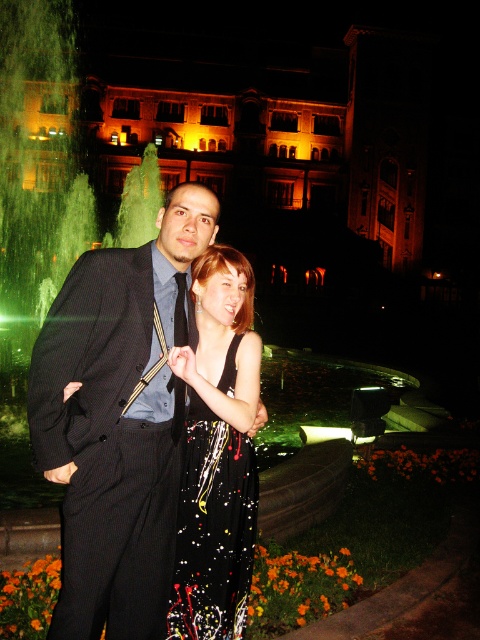
You are a photographer trying to position a spotlight at point 0.6, 0.25 to highlight the black pinstripe suit at center. Will the spotlight hit the correct location?

The black pinstripe suit at center is located at point (119, 420), so the spotlight at (120, 384) is close but slightly to the left and above the actual position of the black pinstripe suit at center. Adjust the spotlight to the right and down slightly for accuracy.

You are standing in front of the fountain and want to take a photo. You notice two points marked in the scene. Which point is closer to you, point (88, 380) or point (252, 294)?

Point (88, 380) is closer to the viewer than point (252, 294).

You are a photographer trying to adjust the lighting for a photo shoot. You notice the black pinstripe suit at center and the sparkly black dress at center. Which one is positioned to the left side of the other?

The black pinstripe suit at center is to the left of the sparkly black dress at center.